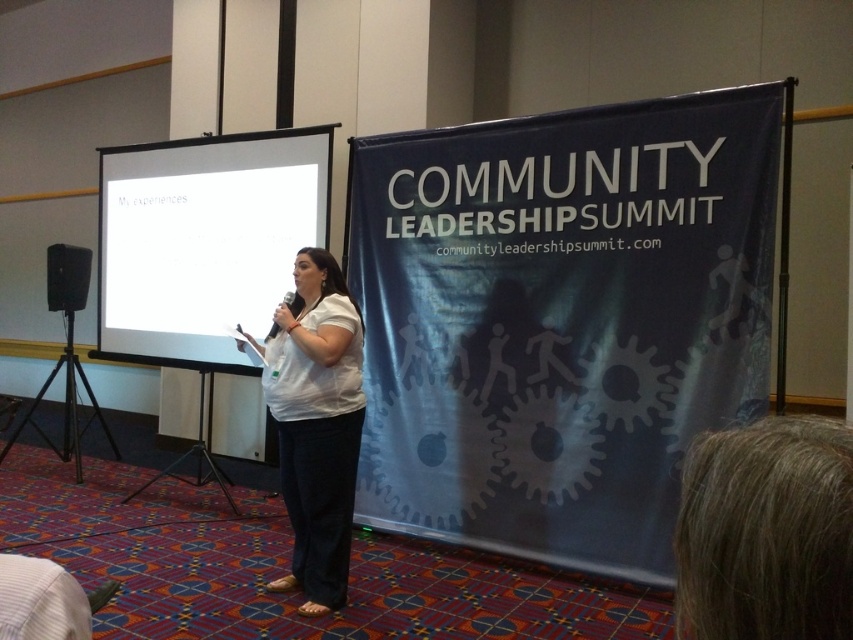
Based on the photo, based on the scene description, what object is located at the coordinates point (204, 241)?

The white glossy projection screen at center is located at point (204, 241).

You are an attendee at the Community Leadership Summit. You want to take a photo of the presenter while ensuring the white glossy projection screen at center and the white matte shirt at center are both clearly visible. Considering their distance, will the camera focus on both objects simultaneously?

The white glossy projection screen at center is 4.32 feet away from the white matte shirt at center. Since the distance between them is relatively small, the camera should be able to focus on both objects simultaneously as they are within a reasonable focusing range.

You are an attendee at the Community Leadership Summit. You notice a white glossy projection screen at center and a white matte shirt at center. Which object is closer to the audience? Please explain your reasoning based on their positions.

The white glossy projection screen at center is closer to the audience because the white matte shirt at center is positioned behind it.